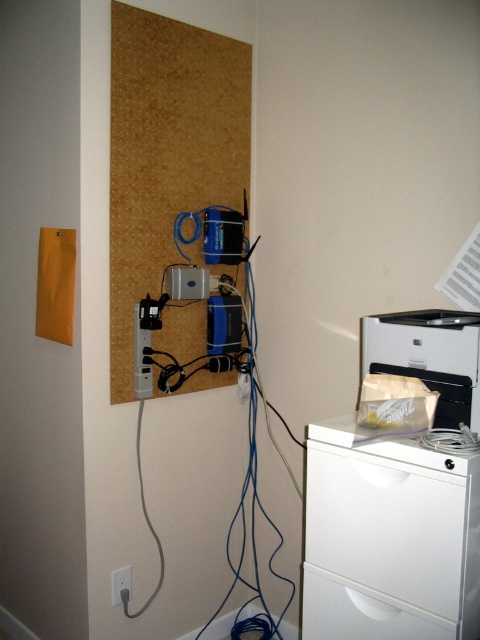
Question: Does white matte printer at lower right appear on the right side of white plastic drawer at lower right?

Choices:
 (A) yes
 (B) no

Answer: (A)

Question: Among these objects, which one is nearest to the camera?

Choices:
 (A) white plastic electric outlet at lower left
 (B) white plastic drawer at lower right
 (C) white plastic file cabinet at lower right
 (D) white matte printer at lower right

Answer: (C)

Question: In this image, where is white plastic drawer at lower right located relative to white plastic electric outlet at lower left?

Choices:
 (A) above
 (B) below

Answer: (A)

Question: Estimate the real-world distances between objects in this image. Which object is closer to the white plastic file cabinet at lower right?

Choices:
 (A) white plastic drawer at lower right
 (B) white matte printer at lower right

Answer: (A)

Question: Does white matte printer at lower right have a larger size compared to white plastic drawer at lower right?

Choices:
 (A) no
 (B) yes

Answer: (B)

Question: Among these points, which one is nearest to the camera?

Choices:
 (A) (424, 348)
 (B) (324, 580)
 (C) (121, 580)
 (D) (440, 493)

Answer: (D)